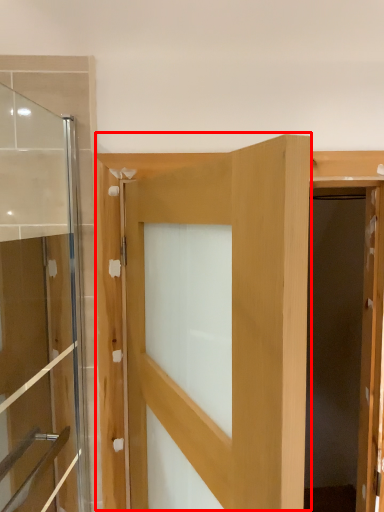
Question: From the image's perspective, where is door (annotated by the red box) located in relation to door in the image?

Choices:
 (A) below
 (B) above

Answer: (A)